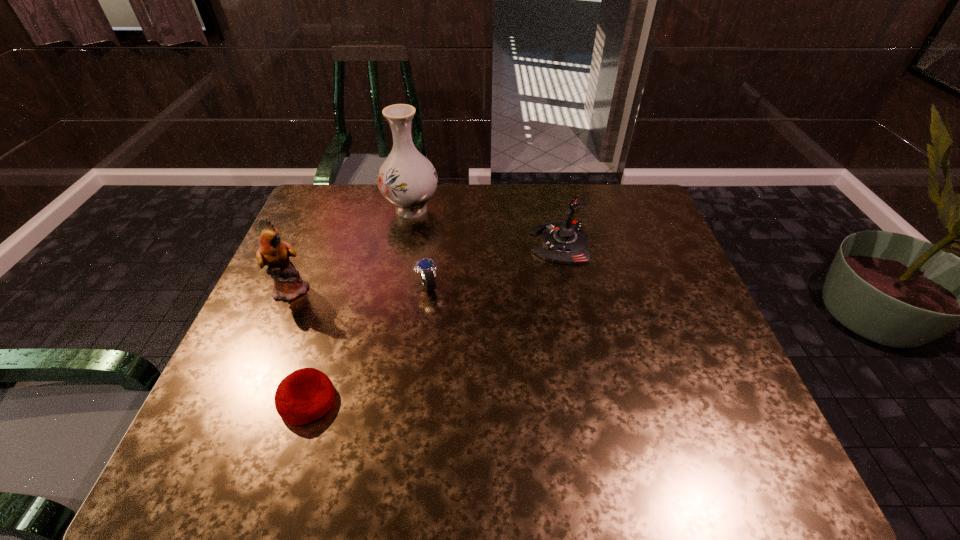
Where is `vase`? The width and height of the screenshot is (960, 540). vase is located at coordinates (407, 179).

This screenshot has width=960, height=540. What are the coordinates of `the leftmost object` in the screenshot? It's located at (x=288, y=284).

At what (x,y) coordinates should I click in order to perform the action: click on parrot. Please return your answer as a coordinate pair (x, y). This screenshot has height=540, width=960. Looking at the image, I should click on (288, 284).

The width and height of the screenshot is (960, 540). What are the coordinates of `joystick` in the screenshot? It's located at (564, 241).

Where is `the third shortest object`? The image size is (960, 540). the third shortest object is located at coordinates (564, 241).

Locate an element on the screen. This screenshot has height=540, width=960. watch is located at coordinates (426, 267).

Find the location of a particular element. The height and width of the screenshot is (540, 960). the nearest object is located at coordinates (305, 395).

Locate an element on the screen. This screenshot has height=540, width=960. blank space located on the left of the vase is located at coordinates (327, 209).

The width and height of the screenshot is (960, 540). I want to click on vacant space positioned 0.090m on the front-facing side of the parrot, so click(x=345, y=289).

Identify the location of free space located on the handle side of the joystick. The image size is (960, 540). (490, 244).